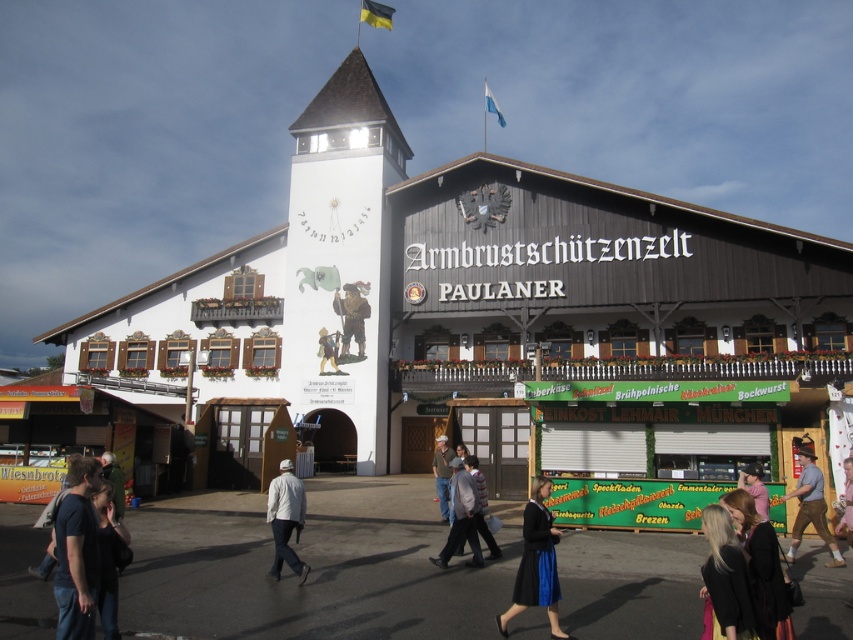
Question: Which of the following is the closest to the observer?

Choices:
 (A) click(x=543, y=573)
 (B) click(x=334, y=308)
 (C) click(x=756, y=540)
 (D) click(x=444, y=472)

Answer: (C)

Question: Estimate the real-world distances between objects in this image. Which object is farther from the denim jacket at center?

Choices:
 (A) black fabric hair at lower right
 (B) black fabric dress at lower right
 (C) pink fabric at center
 (D) wooden figure at center

Answer: (B)

Question: Which object is positioned closest to the black fabric hair at lower right?

Choices:
 (A) pink fabric at center
 (B) wooden statue at center
 (C) black fabric dress at lower right
 (D) dark blue shirt at lower left

Answer: (C)

Question: Observing the image, what is the correct spatial positioning of dark blue shirt at lower left in reference to pink fabric at center?

Choices:
 (A) above
 (B) below

Answer: (B)

Question: Can you confirm if pink fabric at center is smaller than wooden figure at center?

Choices:
 (A) yes
 (B) no

Answer: (B)

Question: Where is blue satin skirt at lower center located in relation to black fabric dress at lower right in the image?

Choices:
 (A) above
 (B) below

Answer: (B)